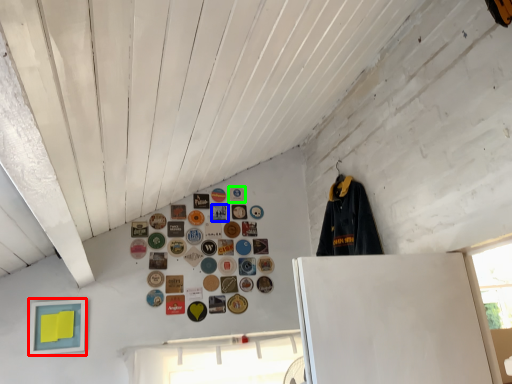
Question: Considering the real-world distances, which object is farthest from picture frame (highlighted by a red box)? button (highlighted by a blue box) or button (highlighted by a green box)?

Choices:
 (A) button
 (B) button

Answer: (B)